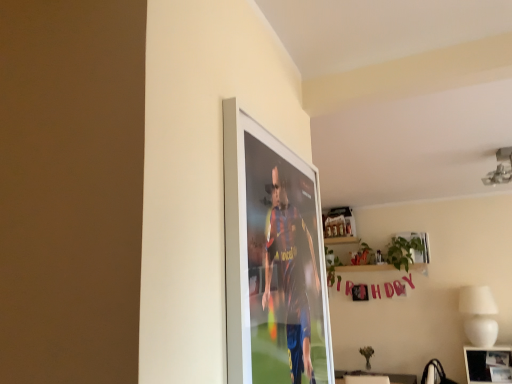
Question: From a real-world perspective, is green leafy plant at upper center above or below metallic silver picture frame at upper right, which is counted as the 2th picture frame, starting from the bottom?

Choices:
 (A) below
 (B) above

Answer: (A)

Question: Based on their sizes in the image, would you say green leafy plant at upper center is bigger or smaller than metallic silver picture frame at upper right, the second picture frame from the right?

Choices:
 (A) big
 (B) small

Answer: (A)

Question: Estimate the real-world distances between objects in this image. Which object is farther from the metallic silver photo frame at lower right, the 2th picture frame when ordered from top to bottom?

Choices:
 (A) white ceramic lamp at lower right
 (B) green leafy plant at upper center
 (C) metallic silver picture frame at upper right, the second picture frame positioned from the front

Answer: (B)

Question: Which is farther from the metallic silver picture frame at upper right, positioned as the first picture frame in back-to-front order?

Choices:
 (A) white ceramic lamp at lower right
 (B) metallic silver photo frame at lower right, positioned as the first picture frame in front-to-back order
 (C) green leafy plant at upper center

Answer: (B)